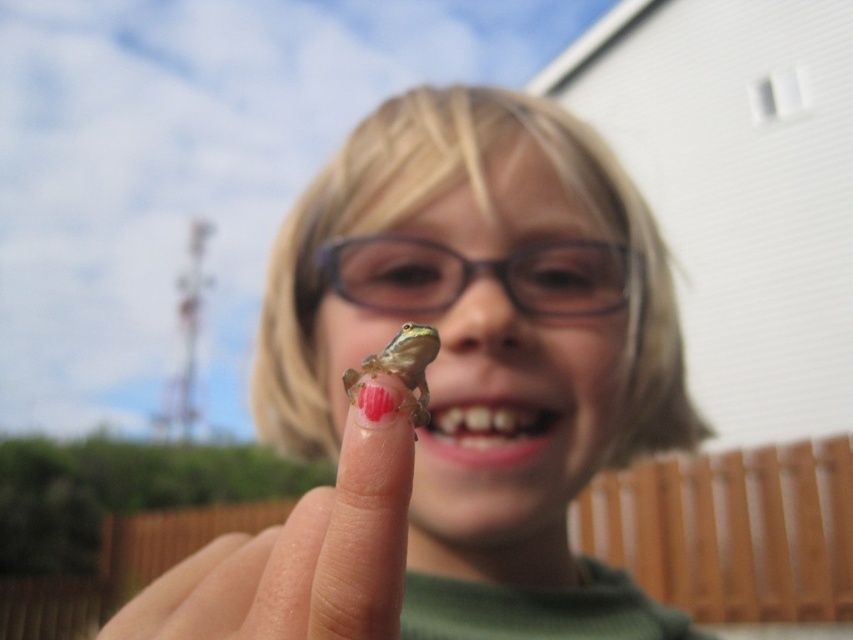
Does transparent plastic glasses at center appear under green matte/frosted object at center?

No.

Based on the photo, measure the distance between point (376, 301) and camera.

They are 90.82 centimeters apart.

Does point (550, 307) come closer to viewer compared to point (432, 358)?

No, it is behind (432, 358).

Find the location of `transparent plastic glasses at center`. transparent plastic glasses at center is located at coordinates (474, 275).

Is the position of smooth green frog at center more distant than that of clear plastic frog at center?

No, it is in front of clear plastic frog at center.

Is smooth green frog at center above clear plastic frog at center?

Correct, smooth green frog at center is located above clear plastic frog at center.

Does point (531, 488) lie behind point (352, 442)?

Yes, point (531, 488) is farther from viewer.

Identify the location of smooth green frog at center. (448, 385).

Which is in front, point (518, 371) or point (450, 445)?

Point (450, 445)

How far apart are smooth green frog at center and pink glossy teeth at lower center?

smooth green frog at center and pink glossy teeth at lower center are 7.40 inches apart.

Is point (566, 332) farther from camera compared to point (532, 422)?

That is True.

Where is `smooth green frog at center`? Image resolution: width=853 pixels, height=640 pixels. smooth green frog at center is located at coordinates (448, 385).